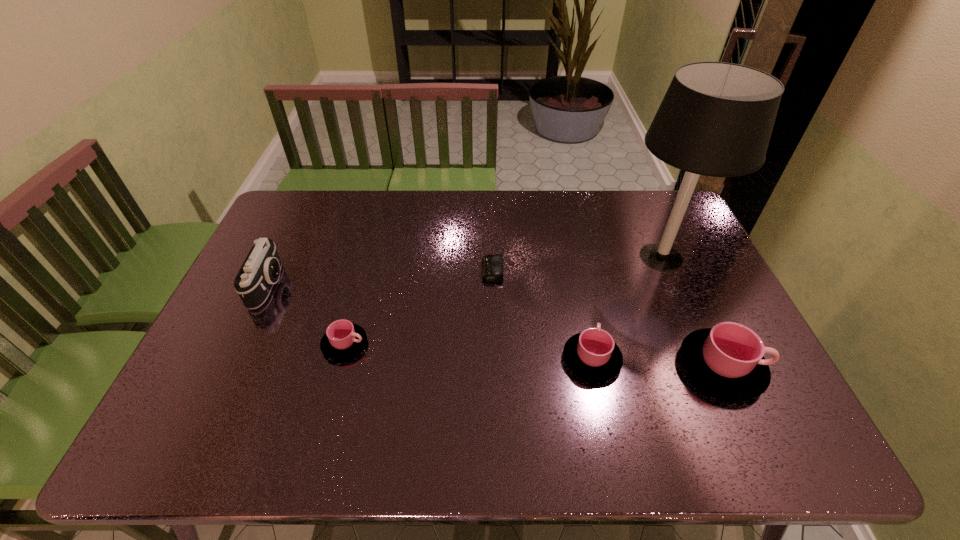
Select which object appears as the closest to the shortest cup. Please provide its 2D coordinates. Your answer should be formatted as a tuple, i.e. [(x, y)], where the tuple contains the x and y coordinates of a point satisfying the conditions above.

[(260, 271)]

I want to click on the fourth closest object to the fourth shortest object, so click(x=343, y=339).

Choose which cup is the second nearest neighbor to the table lamp. Please provide its 2D coordinates. Your answer should be formatted as a tuple, i.e. [(x, y)], where the tuple contains the x and y coordinates of a point satisfying the conditions above.

[(592, 354)]

Find the location of a particular element. The width and height of the screenshot is (960, 540). the closest cup to the camera is located at coordinates (343, 339).

At what (x,y) coordinates should I click in order to perform the action: click on vacant area in the image that satisfies the following two spatial constraints: 1. on the side with the handle of the second shortest cup; 2. on the front lens of the second tallest object. Please return your answer as a coordinate pair (x, y). This screenshot has height=540, width=960. Looking at the image, I should click on (576, 285).

This screenshot has width=960, height=540. I want to click on vacant region that satisfies the following two spatial constraints: 1. on the side with the handle of the second cup from right to left; 2. on the side with the handle of the shortest cup, so click(588, 344).

Where is `free spot that satisfies the following two spatial constraints: 1. on the side with the handle of the third shortest object; 2. on the side with the handle of the fifth object from right to left`? This screenshot has width=960, height=540. free spot that satisfies the following two spatial constraints: 1. on the side with the handle of the third shortest object; 2. on the side with the handle of the fifth object from right to left is located at coordinates (588, 344).